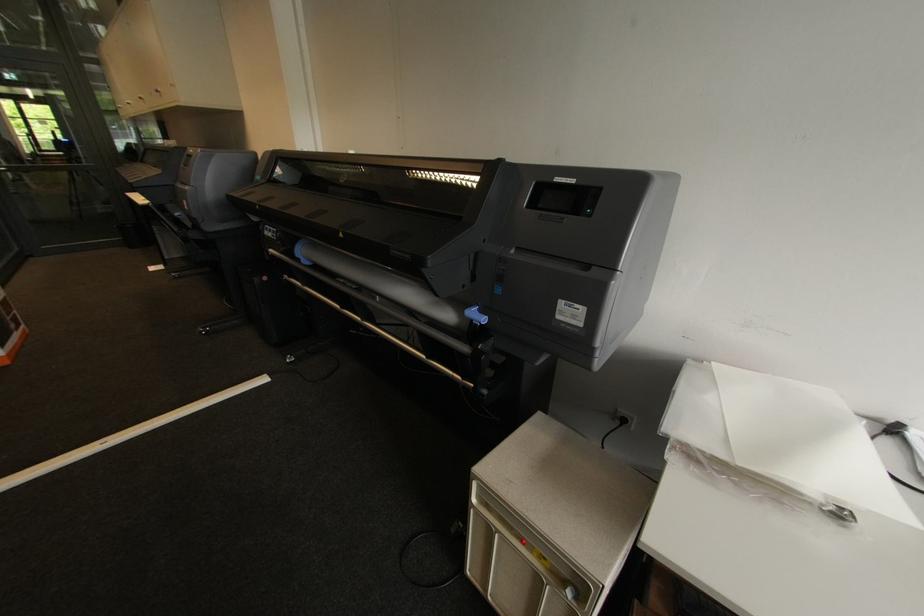
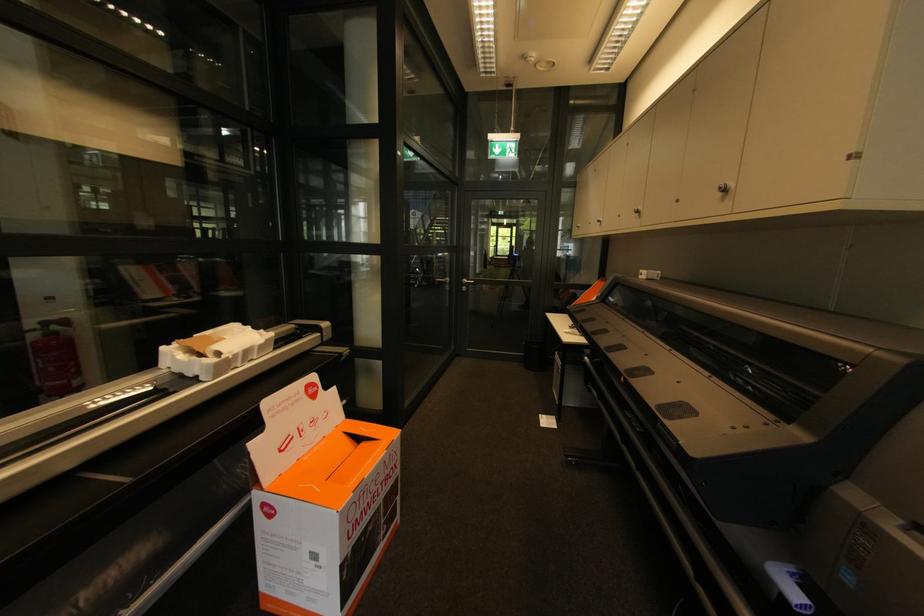
Locate, in the second image, the point that corresponds to the point at 162,92 in the first image.

(727, 191)